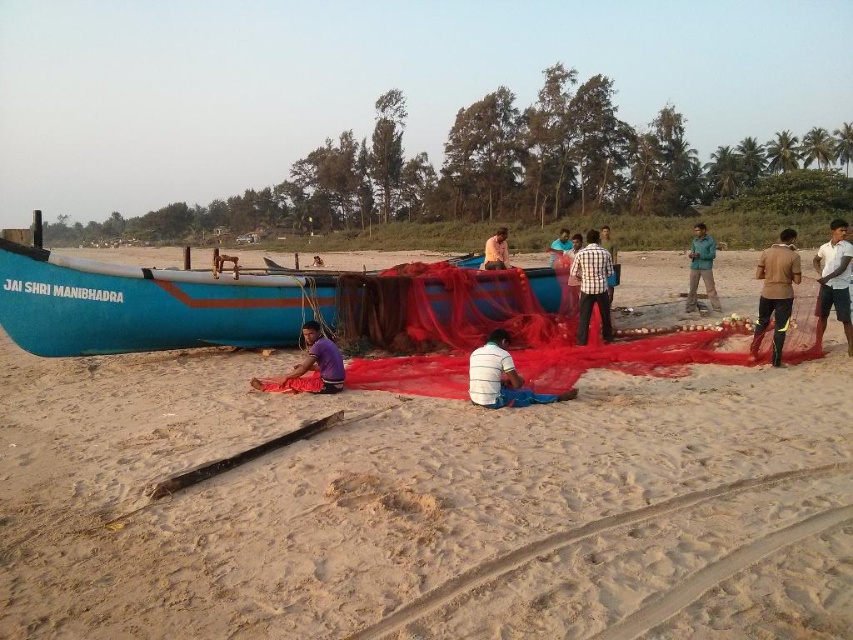
Is white cotton shirt at right wider than purple fabric at center?

Correct, the width of white cotton shirt at right exceeds that of purple fabric at center.

Measure the distance from white cotton shirt at right to purple fabric at center.

white cotton shirt at right and purple fabric at center are 5.60 meters apart from each other.

In order to click on white cotton shirt at right in this screenshot , I will do `click(834, 280)`.

In the scene shown: Can you confirm if checkered fabric shirt at center is positioned above green fabric at center?

No, checkered fabric shirt at center is not above green fabric at center.

Who is taller, checkered fabric shirt at center or green fabric at center?

With more height is green fabric at center.

This screenshot has width=853, height=640. I want to click on checkered fabric shirt at center, so click(592, 285).

At what (x,y) coordinates should I click in order to perform the action: click on checkered fabric shirt at center. Please return your answer as a coordinate pair (x, y). This screenshot has height=640, width=853. Looking at the image, I should click on (592, 285).

Which is below, blue painted boat at center or green fabric at center?

blue painted boat at center

Is point (245, 444) positioned after point (712, 307)?

No, (245, 444) is closer to viewer.

You are a GUI agent. You are given a task and a screenshot of the screen. Output one action in this format:
    pyautogui.click(x=<x>, y=<y>)
    Task: Click on the blue painted boat at center
    The width and height of the screenshot is (853, 640).
    Given the screenshot: What is the action you would take?
    pyautogui.click(x=389, y=499)